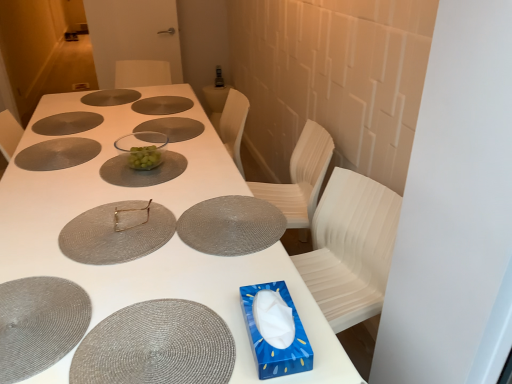
Find the location of `vacant area that lies between matte gray placemat at center, the 8th glass plate positioned from the back, and matte gray placemat at center, placed as the third glass plate when sorted from front to back`. vacant area that lies between matte gray placemat at center, the 8th glass plate positioned from the back, and matte gray placemat at center, placed as the third glass plate when sorted from front to back is located at coordinates (172, 218).